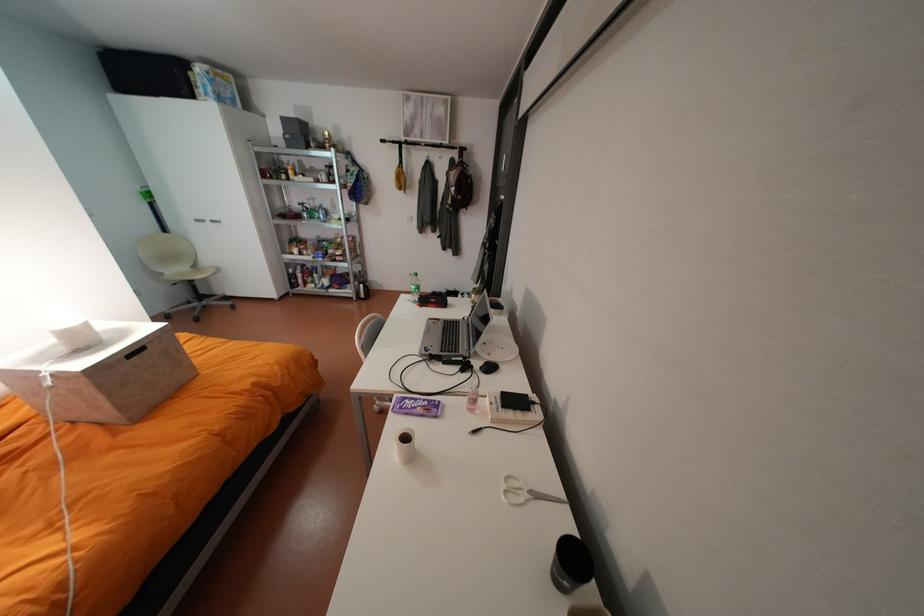
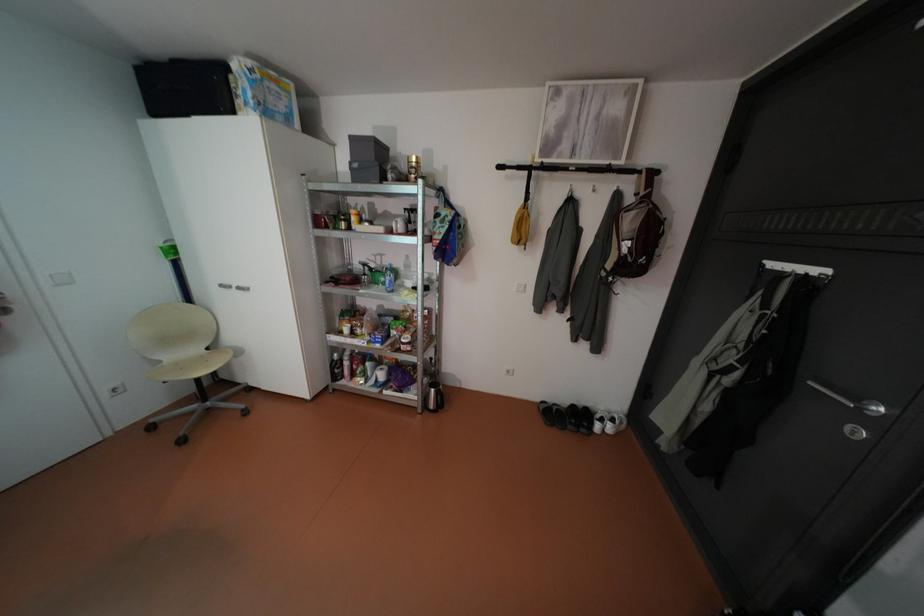
The point at [321,217] is marked in the first image. Where is the corresponding point in the second image?

(383, 282)